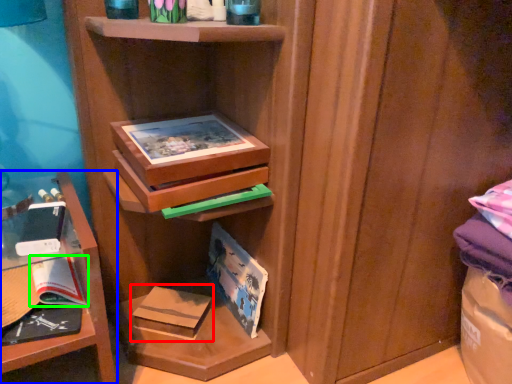
Question: Considering the real-world distances, which object is closest to paperback book (highlighted by a red box)? shelf (highlighted by a blue box) or paperback book (highlighted by a green box).

Choices:
 (A) shelf
 (B) paperback book

Answer: (B)